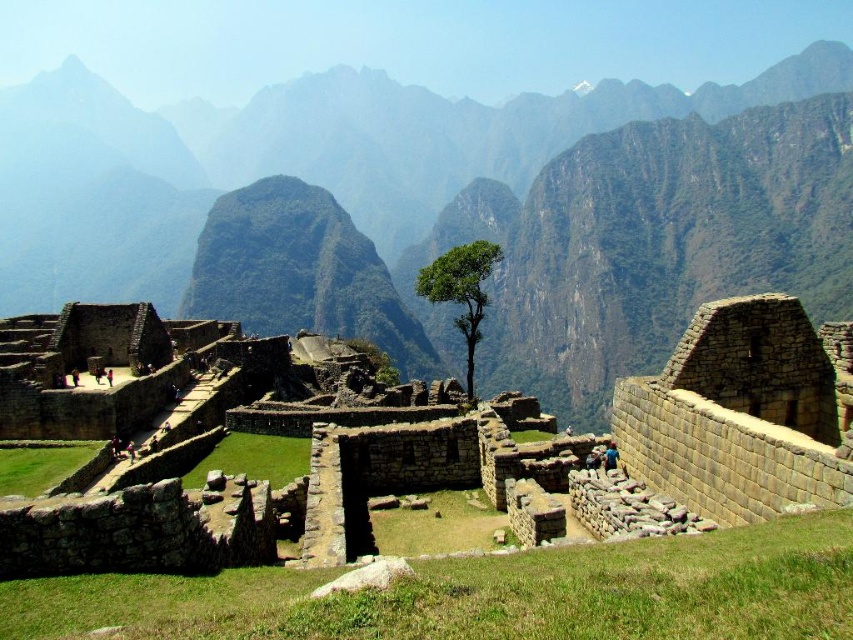
You are a hiker who wants to take a photo of the rugged stone mountain at center and the green leafy tree at center. Based on their widths, which one should you zoom in on to ensure both fit in the frame?

The rugged stone mountain at center might be wider than the green leafy tree at center, so you should zoom out to capture both in the frame.